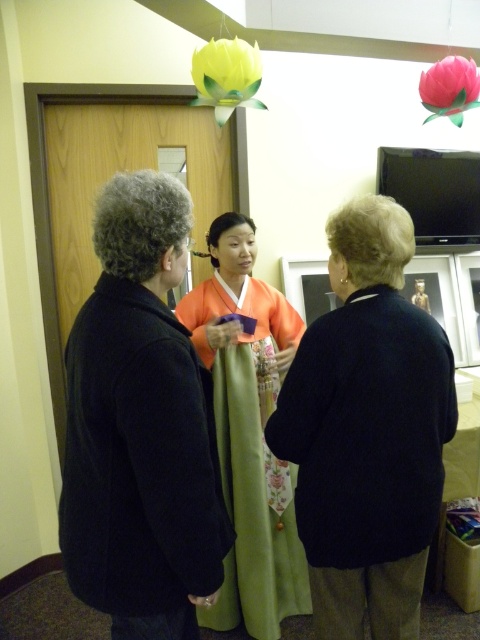
Question: Based on their relative distances, which object is farther from the green silk robe at center?

Choices:
 (A) yellow paper flower at upper center
 (B) orange satin kimono at center
 (C) green satin robe at center
 (D) pink fabric flower at upper center

Answer: (D)

Question: Is green silk robe at center to the left of yellow paper flower at upper center from the viewer's perspective?

Choices:
 (A) no
 (B) yes

Answer: (B)

Question: Which point appears closest to the camera in this image?

Choices:
 (A) (216, 108)
 (B) (447, 420)
 (C) (437, 64)

Answer: (B)

Question: Does green satin robe at center have a larger size compared to yellow paper flower at upper center?

Choices:
 (A) no
 (B) yes

Answer: (A)

Question: Is green satin robe at center smaller than yellow paper flower at upper center?

Choices:
 (A) yes
 (B) no

Answer: (A)

Question: Which point is closer to the camera?

Choices:
 (A) green silk robe at center
 (B) green satin robe at center
 (C) yellow paper flower at upper center

Answer: (A)